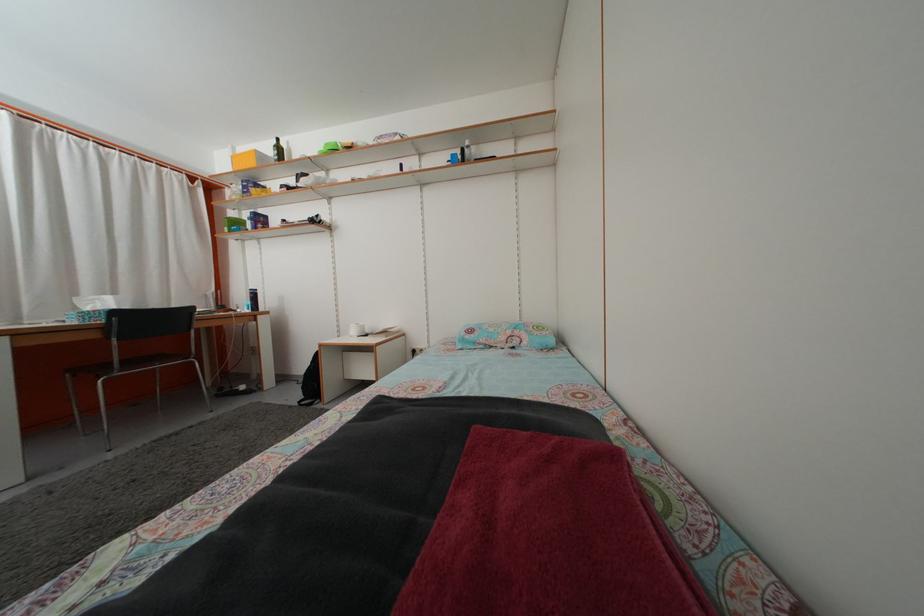
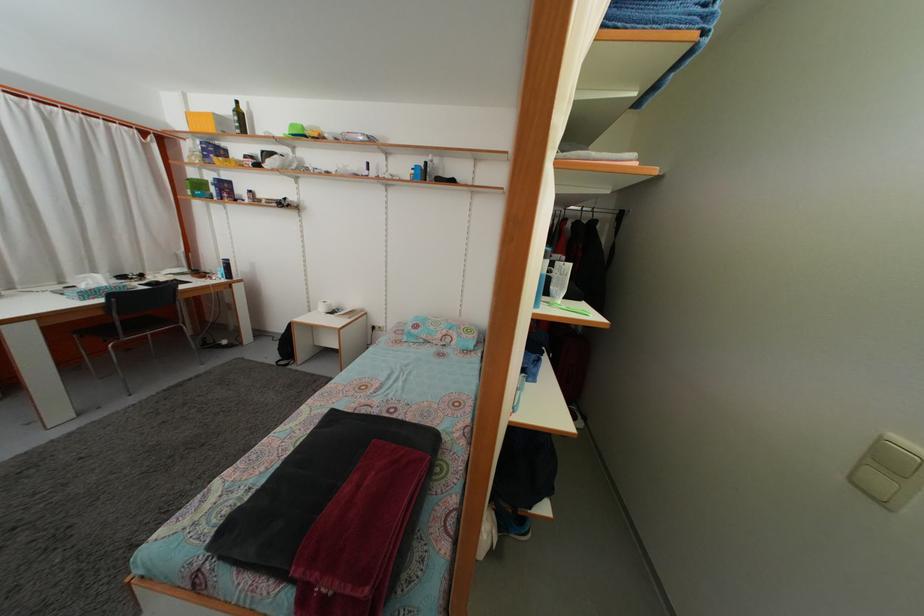
Locate, in the second image, the point that corresponds to point 286,156 in the first image.

(246, 122)